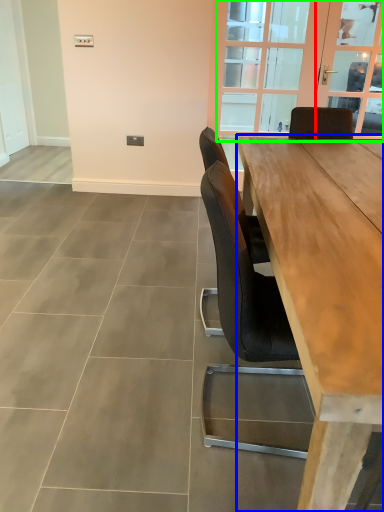
Question: Which object is positioned farthest from window screen (highlighted by a red box)? Select from table (highlighted by a blue box) and window (highlighted by a green box).

Choices:
 (A) table
 (B) window

Answer: (A)